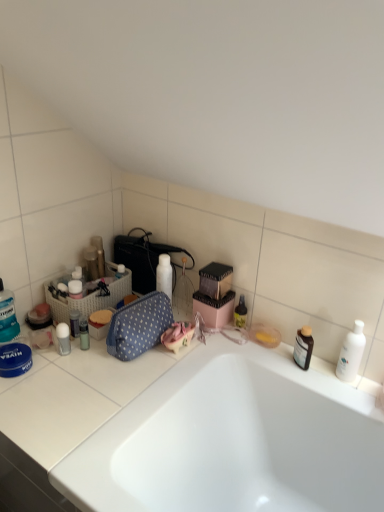
This screenshot has height=512, width=384. I want to click on spots to the right of metallic silver container at left, positioned as the sixth toiletry in right-to-left order, so click(124, 362).